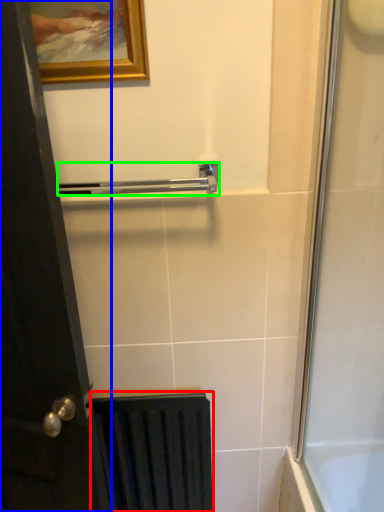
Question: Estimate the real-world distances between objects in this image. Which object is closer to radiator (highlighted by a red box), door (highlighted by a blue box) or towel bar (highlighted by a green box)?

Choices:
 (A) door
 (B) towel bar

Answer: (A)